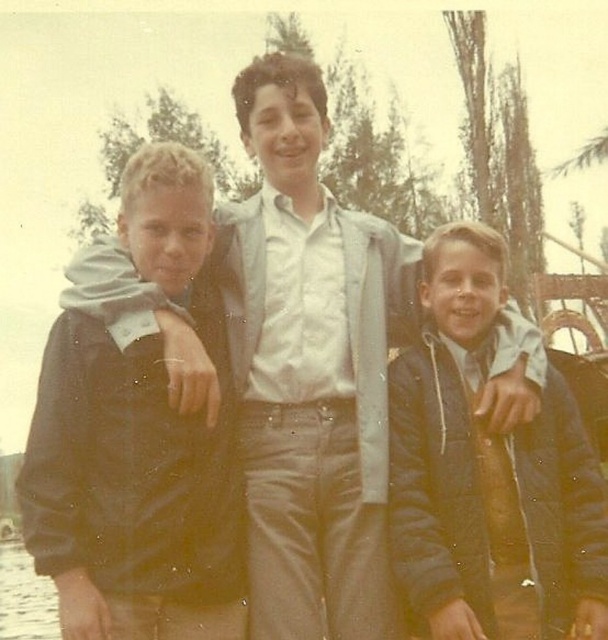
You are a photographer trying to capture a group shot of the boys. You notice the dark blue jacket at center and the clear water at lower left in the frame. Which object takes up more space in the photo?

The clear water at lower left takes up more space in the photo because the dark blue jacket at center occupies less space than clear water at lower left.

You are a tailor who needs to compare the jackets of the two boys in the image. Which jacket is wider, the dark brown leather jacket at left or the dark blue jacket at center?

The dark brown leather jacket at left is wider than the dark blue jacket at center according to the description.